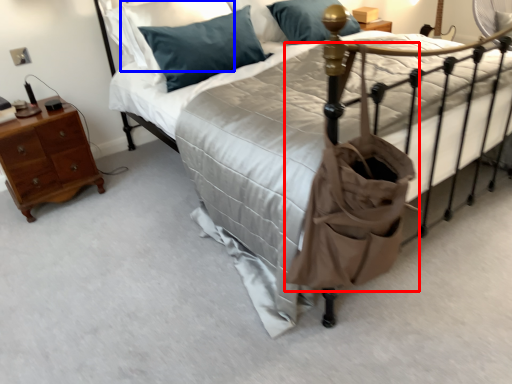
Question: Which object is further to the camera taking this photo, bag (highlighted by a red box) or pillow (highlighted by a blue box)?

Choices:
 (A) bag
 (B) pillow

Answer: (B)